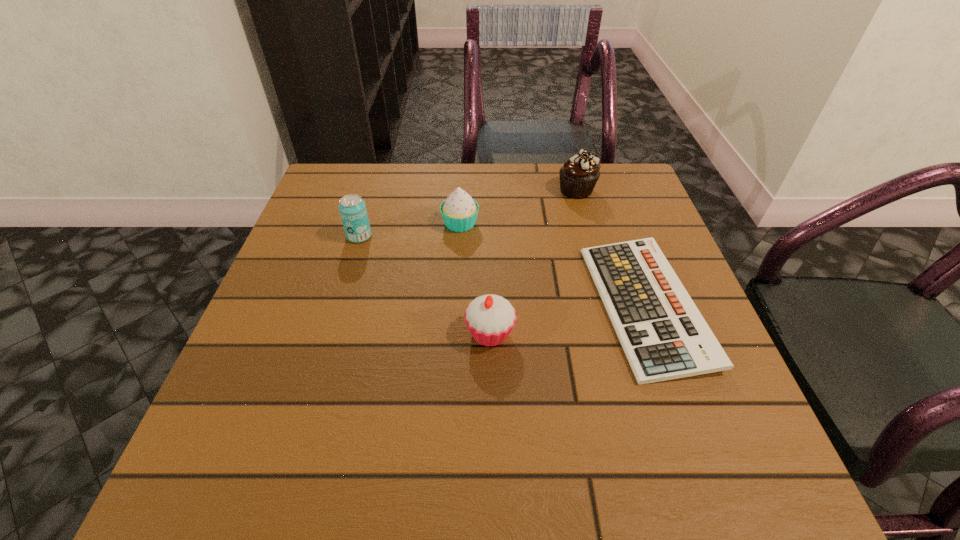
Where is `object that is the second closest to the shortest object`? The width and height of the screenshot is (960, 540). object that is the second closest to the shortest object is located at coordinates (578, 176).

Point out which cupcake is positioned as the second nearest to the second nearest cupcake. Please provide its 2D coordinates. Your answer should be formatted as a tuple, i.e. [(x, y)], where the tuple contains the x and y coordinates of a point satisfying the conditions above.

[(490, 318)]

Locate an element on the screen. The image size is (960, 540). cupcake that is the closest to the shortest object is located at coordinates (490, 318).